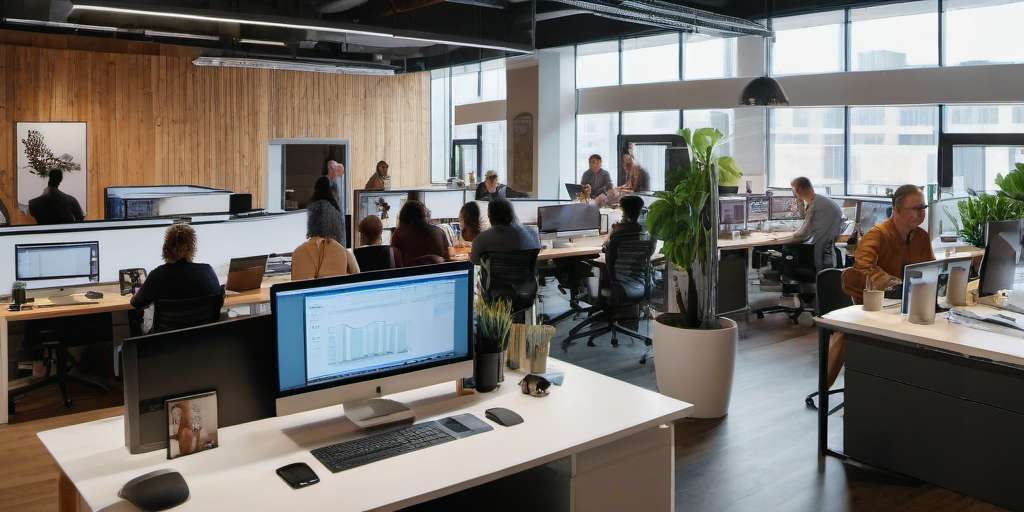
Image resolution: width=1024 pixels, height=512 pixels. I want to click on lower windows, so click(x=469, y=133), click(x=503, y=134), click(x=591, y=133), click(x=649, y=126), click(x=702, y=123), click(x=809, y=132), click(x=901, y=128), click(x=988, y=112).